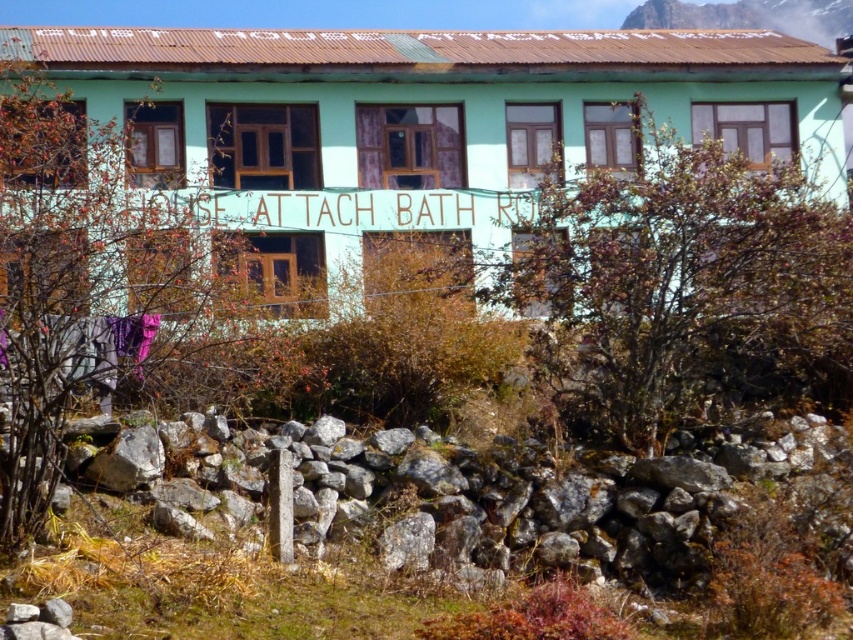
The image size is (853, 640). In order to click on gray rock wall at lower center in this screenshot , I will do `click(548, 493)`.

The height and width of the screenshot is (640, 853). I want to click on gray rock wall at lower center, so click(x=548, y=493).